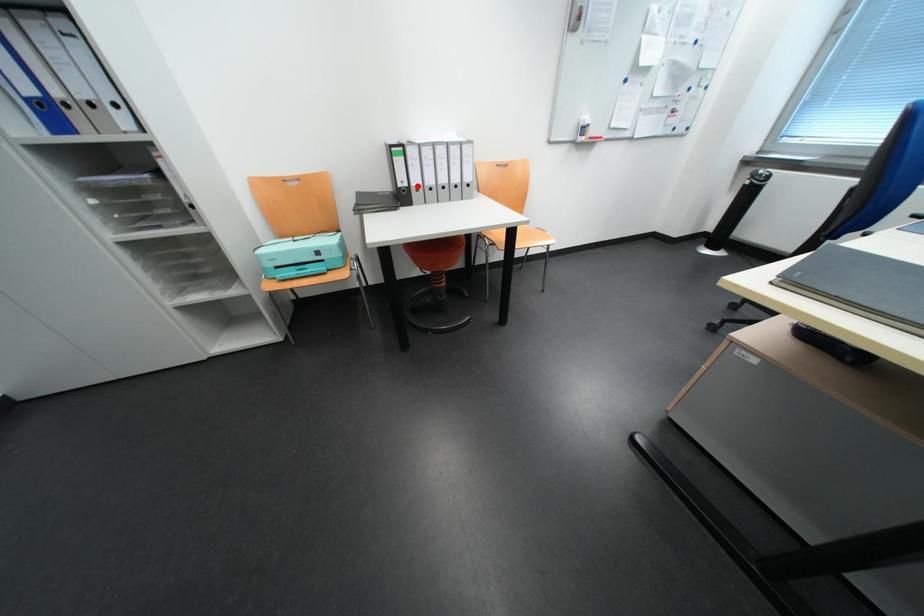
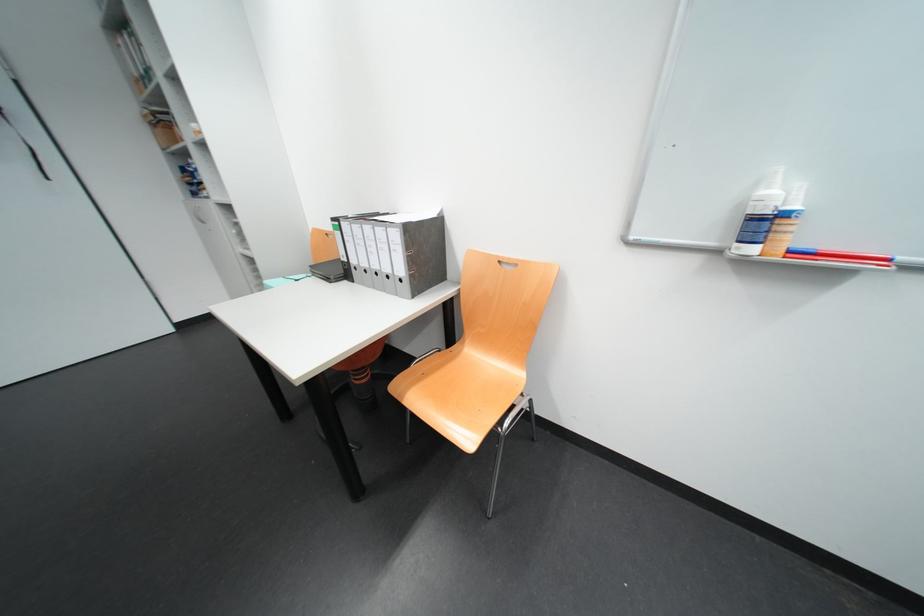
Locate, in the second image, the point that corresponds to the highlighted location in the first image.

(358, 262)